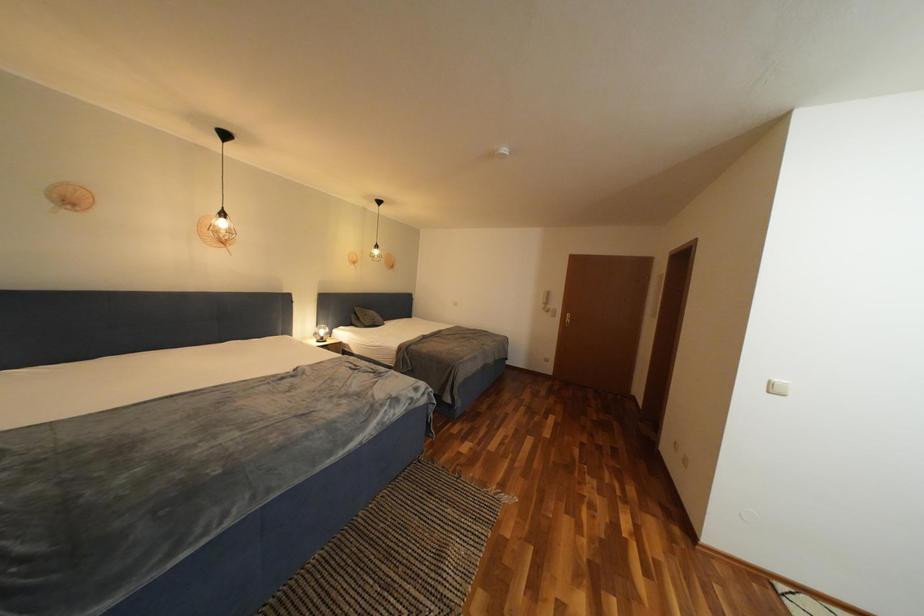
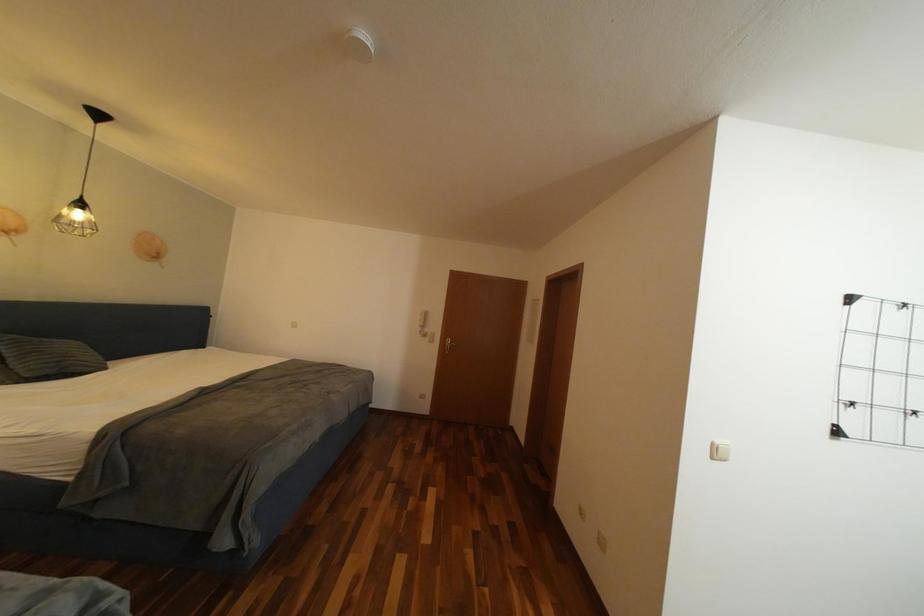
Question: The camera is either moving clockwise (left) or counter-clockwise (right) around the object. The first image is from the beginning of the video and the second image is from the end. Is the camera moving left or right when shooting the video?

Choices:
 (A) Left
 (B) Right

Answer: (A)